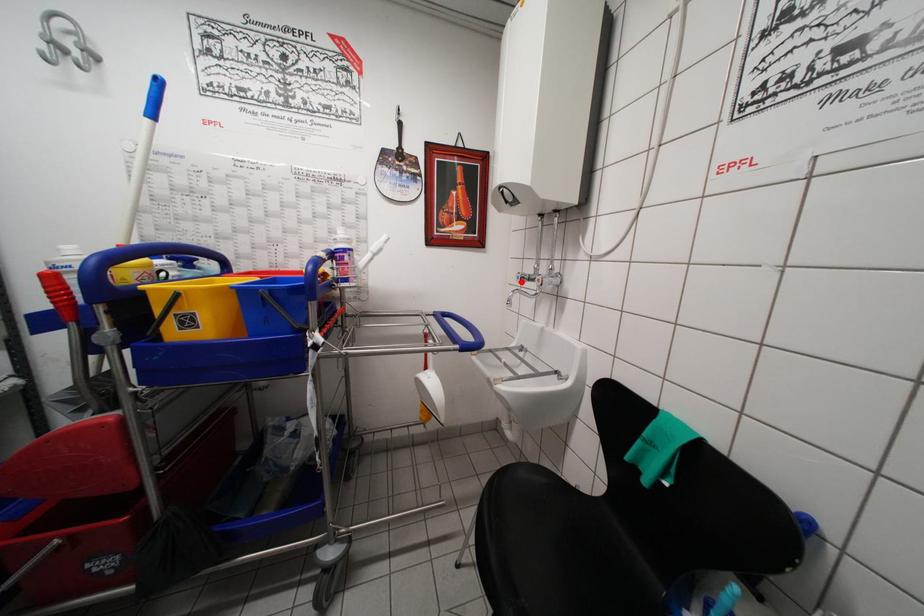
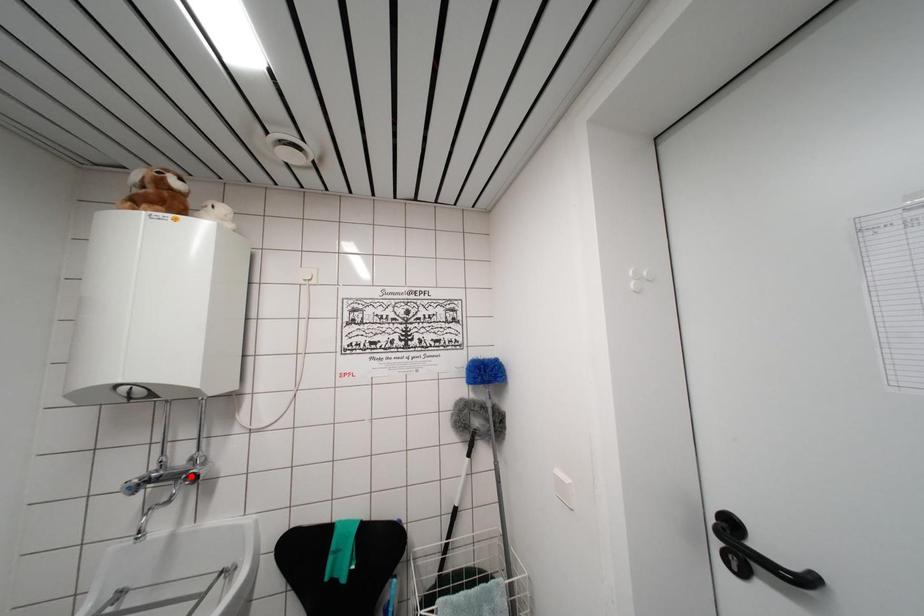
I am providing you with two images of the same scene from different viewpoints. A red point is marked on the first image and another point is marked on the second image. Does the point marked in image1 correspond to the same location as the one in image2?

No